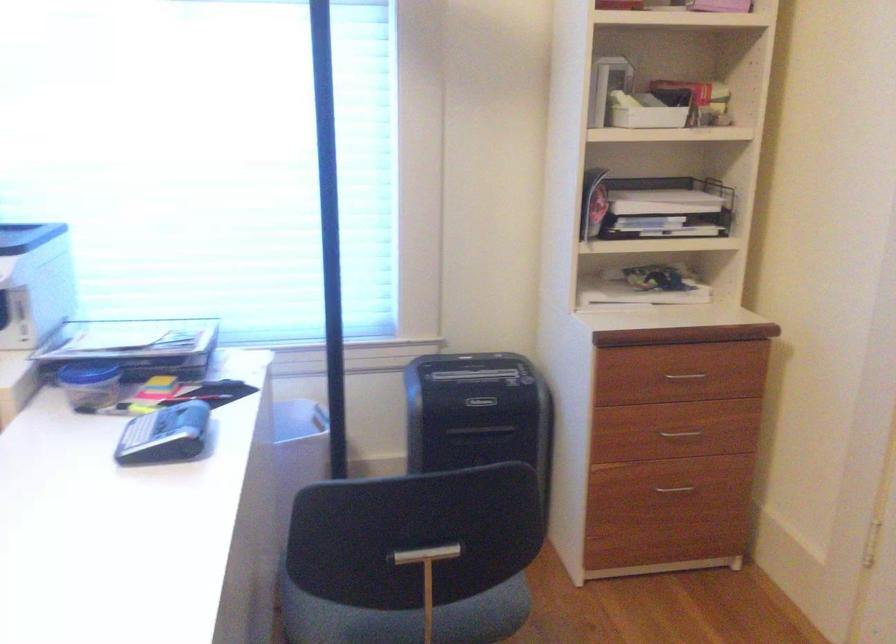
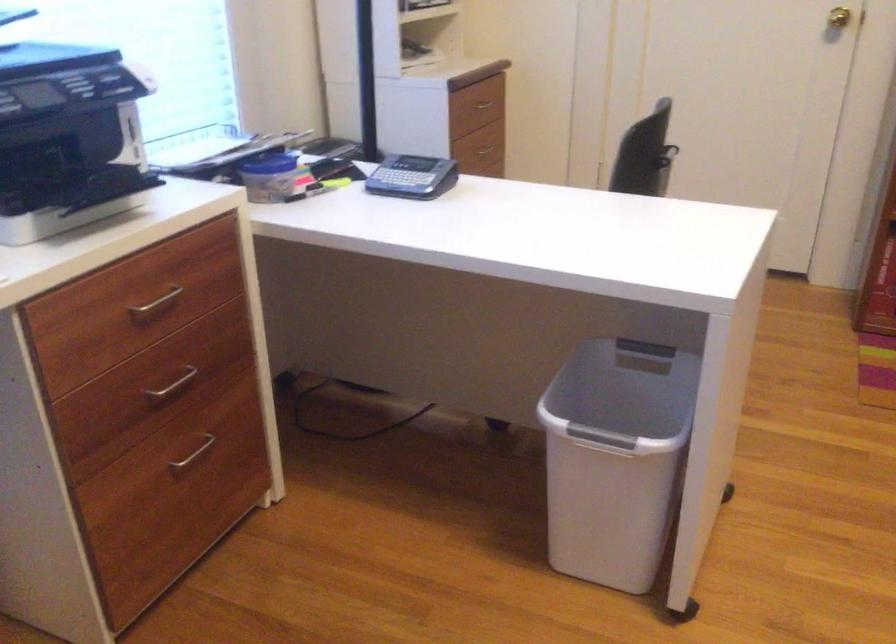
Locate, in the second image, the point that corresponds to (83,365) in the first image.

(270, 164)